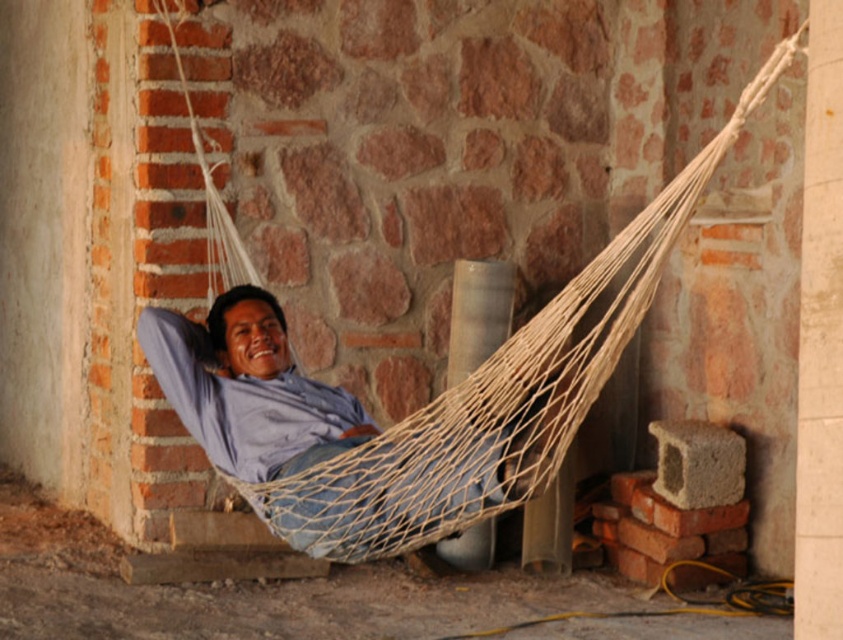
Can you confirm if smooth concrete pillar at center is wider than white concrete pillar at center?

No, smooth concrete pillar at center is not wider than white concrete pillar at center.

Which is in front, point (831, 586) or point (498, 323)?

Point (831, 586)

Where is `smooth concrete pillar at center`? Image resolution: width=843 pixels, height=640 pixels. smooth concrete pillar at center is located at coordinates (820, 339).

What are the coordinates of `smooth concrete pillar at center` in the screenshot? It's located at (820, 339).

Between blue cotton shirt at center and white concrete pillar at center, which one appears on the right side from the viewer's perspective?

white concrete pillar at center

The image size is (843, 640). In order to click on blue cotton shirt at center in this screenshot , I will do `click(248, 388)`.

Is natural fiber hammock at center wider than smooth concrete pillar at center?

Correct, the width of natural fiber hammock at center exceeds that of smooth concrete pillar at center.

Which is in front, point (234, 467) or point (830, 182)?

Point (830, 182) is more forward.

Image resolution: width=843 pixels, height=640 pixels. In order to click on natural fiber hammock at center in this screenshot , I will do `click(454, 396)`.